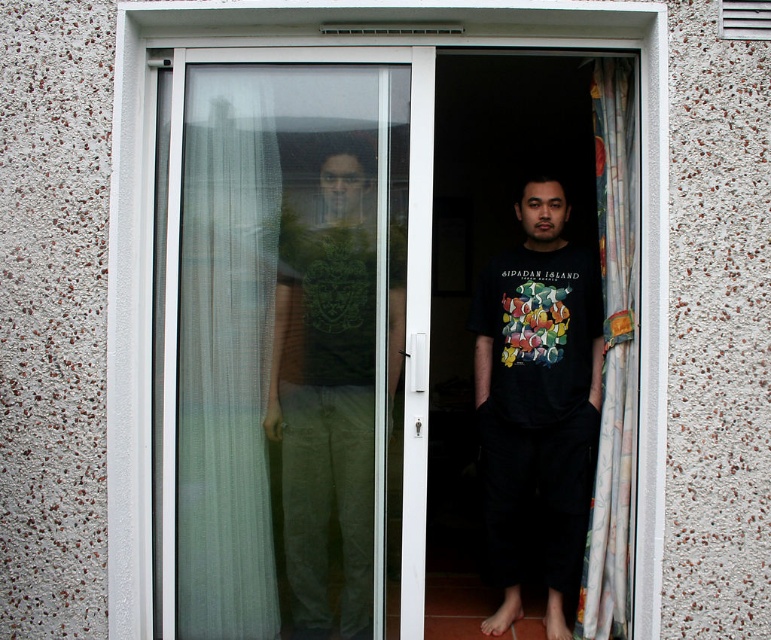
Who is shorter, transparent glass door at center or green matte t-shirt at center?

Standing shorter between the two is green matte t-shirt at center.

Between transparent glass door at center and green matte t-shirt at center, which one is positioned lower?

green matte t-shirt at center

Image resolution: width=771 pixels, height=640 pixels. What do you see at coordinates (409, 216) in the screenshot? I see `transparent glass door at center` at bounding box center [409, 216].

This screenshot has width=771, height=640. What are the coordinates of `transparent glass door at center` in the screenshot? It's located at (409, 216).

Between point (345, 184) and point (566, 42), which one is positioned behind?

Positioned behind is point (345, 184).

Between transparent plastic screen door at center and transparent glass door at center, which one is positioned higher?

transparent glass door at center

Is point (315, 196) closer to viewer compared to point (490, 22)?

No, (315, 196) is behind (490, 22).

Locate an element on the screen. transparent plastic screen door at center is located at coordinates (283, 348).

Which is in front, point (187, 52) or point (372, 122)?

Point (187, 52) is in front.

Is point (507, 36) closer to viewer compared to point (221, 147)?

Yes.

Image resolution: width=771 pixels, height=640 pixels. I want to click on transparent glass door at center, so click(x=409, y=216).